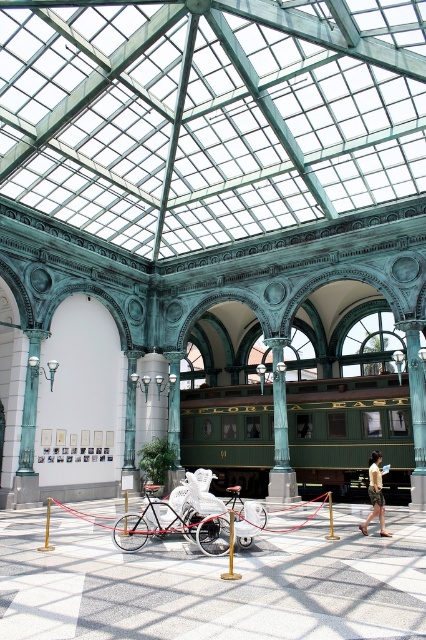
From the picture: You are standing at the point marked by the coordinates (279, 432) in the grand building. What is the nearest object to you?

The point at (279, 432) is on the green polished stone column at center, so the nearest object to you is the green polished stone column at center.

You are a tour guide explaining the exhibits in this grand building. You have to mention both the red matte tricycle at center and the white matte bicycle at center. Which one is larger in size?

The red matte tricycle at center is bigger than the white matte bicycle at center.

You are a visitor at this grand building and want to take a photo of both the green polished wood train car at center and the red matte tricycle at center. Since you want to include both in the same frame, which object should you position closer to the camera to ensure both fit in the photo?

To include both the green polished wood train car at center and the red matte tricycle at center in the same frame, you should position the green polished wood train car at center closer to the camera. Since it is bigger, moving it closer will help balance their sizes in the photo.